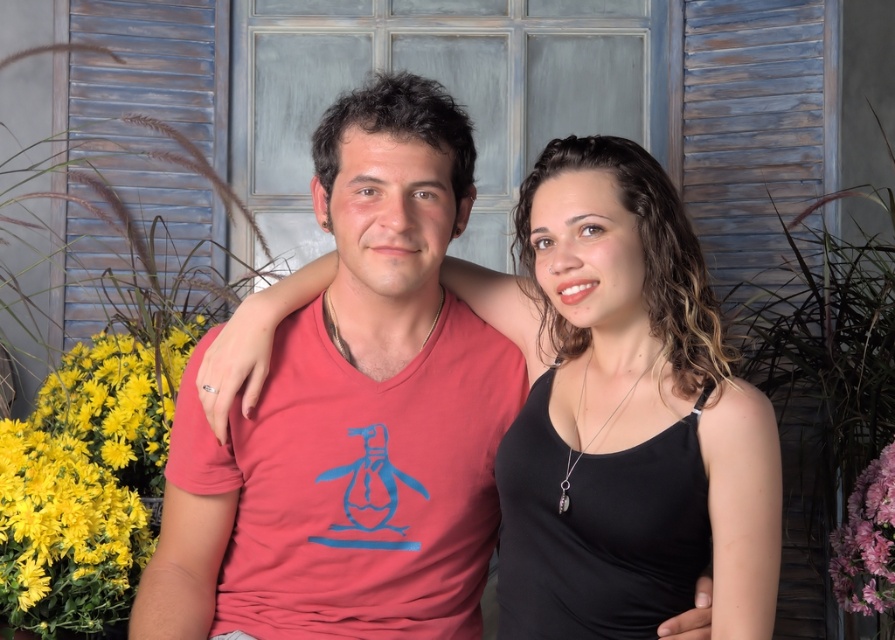
Is matte red t-shirt at center below pink matte flower at right?

Incorrect, matte red t-shirt at center is not positioned below pink matte flower at right.

Is point (239, 496) positioned in front of point (889, 612)?

Yes, it is in front of point (889, 612).

Is point (279, 426) positioned in front of point (891, 444)?

Yes, it is in front of point (891, 444).

This screenshot has width=895, height=640. Find the location of `matte red t-shirt at center`. matte red t-shirt at center is located at coordinates pyautogui.click(x=352, y=416).

Is point (197, 36) positioned behind point (845, 564)?

Yes, it is.

Who is more forward, [203,134] or [874,547]?

Point [874,547]

Find the location of a particular element. metallic blue shutter at upper left is located at coordinates (152, 112).

This screenshot has height=640, width=895. Find the location of `metallic blue shutter at upper left`. metallic blue shutter at upper left is located at coordinates (152, 112).

Is matte red t-shirt at center below metallic blue shutter at upper left?

Yes, matte red t-shirt at center is below metallic blue shutter at upper left.

Is matte red t-shirt at center bigger than metallic blue shutter at upper left?

Yes.

Locate an element on the screen. This screenshot has height=640, width=895. matte red t-shirt at center is located at coordinates (352, 416).

Identify the location of matte red t-shirt at center. This screenshot has height=640, width=895. (352, 416).